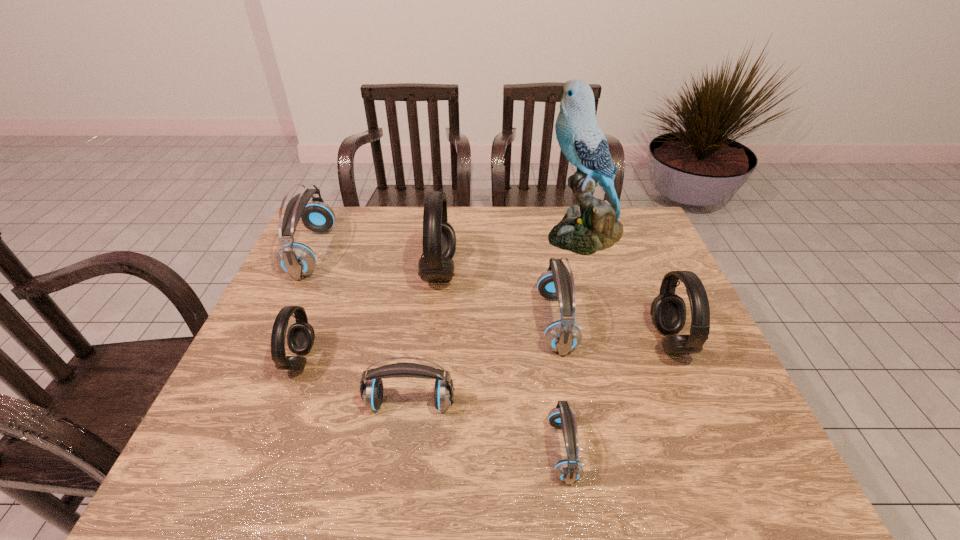
The height and width of the screenshot is (540, 960). In order to click on the third biggest blue headset in this screenshot , I will do click(371, 392).

Find the location of a particular element. This screenshot has height=540, width=960. the shortest headset is located at coordinates (569, 470).

You are a GUI agent. You are given a task and a screenshot of the screen. Output one action in this format:
    pyautogui.click(x=<x>, y=<y>)
    Task: Click on the smallest blue headset
    The height and width of the screenshot is (540, 960).
    Given the screenshot: What is the action you would take?
    pyautogui.click(x=569, y=470)

Identify the location of free space located 0.160m on the face of the tallest object. This screenshot has width=960, height=540. (494, 234).

You are a GUI agent. You are given a task and a screenshot of the screen. Output one action in this format:
    pyautogui.click(x=<x>, y=<y>)
    Task: Click on the vacant space located on the face of the tallest object
    The width and height of the screenshot is (960, 540).
    Given the screenshot: What is the action you would take?
    pyautogui.click(x=479, y=234)

At what (x,y) coordinates should I click in order to perform the action: click on vacant space located on the face of the tallest object. Please return your answer as a coordinate pair (x, y). Looking at the image, I should click on (492, 234).

This screenshot has width=960, height=540. I want to click on free space located on the earcups of the second gray headset from left to right, so pos(585,272).

This screenshot has height=540, width=960. Find the location of `vacant space located on the ear cups of the leftmost blue headset`. vacant space located on the ear cups of the leftmost blue headset is located at coordinates (392, 252).

Where is `blank space located 0.070m on the earcups of the rightmost headset`? blank space located 0.070m on the earcups of the rightmost headset is located at coordinates (626, 341).

You are a GUI agent. You are given a task and a screenshot of the screen. Output one action in this format:
    pyautogui.click(x=<x>, y=<y>)
    Task: Click on the vacant space located on the earcups of the rightmost headset
    The width and height of the screenshot is (960, 540).
    Given the screenshot: What is the action you would take?
    pyautogui.click(x=537, y=341)